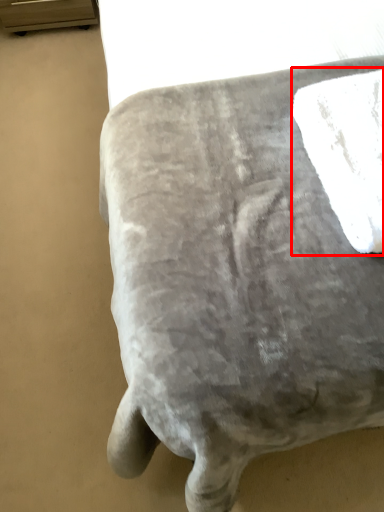
Question: Observing the image, what is the correct spatial positioning of bath towel (annotated by the red box) in reference to furniture?

Choices:
 (A) right
 (B) left

Answer: (A)